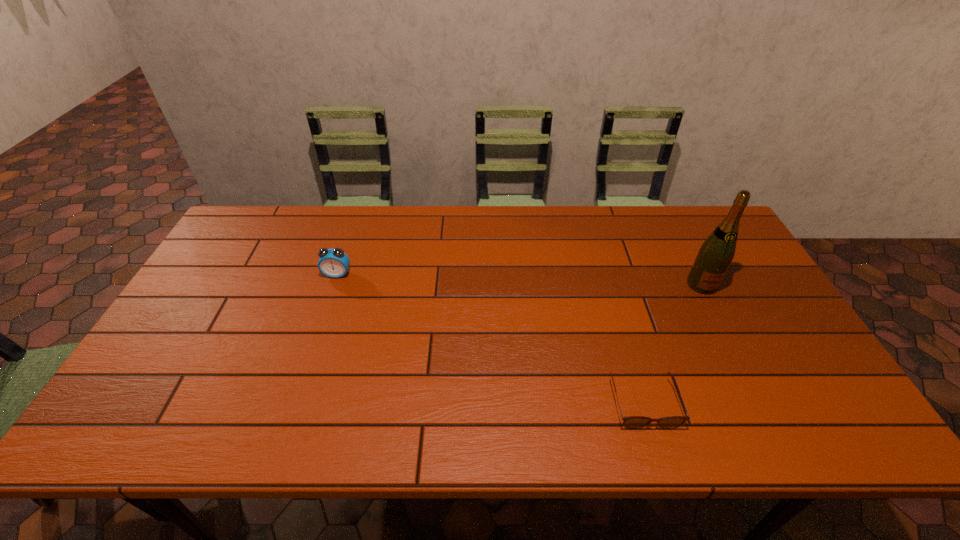
Find the location of a particular element. This screenshot has height=540, width=960. vacant region between the leftmost object and the tallest object is located at coordinates (519, 279).

Where is `unoccupied area between the second object from right to left and the second shortest object`? The image size is (960, 540). unoccupied area between the second object from right to left and the second shortest object is located at coordinates (491, 339).

This screenshot has width=960, height=540. I want to click on free spot between the rightmost object and the second object from left to right, so click(672, 344).

Where is `empty space that is in between the spectacles and the tallest object`? This screenshot has width=960, height=540. empty space that is in between the spectacles and the tallest object is located at coordinates (672, 344).

The height and width of the screenshot is (540, 960). Find the location of `unoccupied position between the wine bottle and the alarm clock`. unoccupied position between the wine bottle and the alarm clock is located at coordinates (519, 279).

Point out which object is positioned as the nearest to the spectacles. Please provide its 2D coordinates. Your answer should be formatted as a tuple, i.e. [(x, y)], where the tuple contains the x and y coordinates of a point satisfying the conditions above.

[(715, 255)]

Choose which object is the nearest neighbor to the nearest object. Please provide its 2D coordinates. Your answer should be formatted as a tuple, i.e. [(x, y)], where the tuple contains the x and y coordinates of a point satisfying the conditions above.

[(715, 255)]